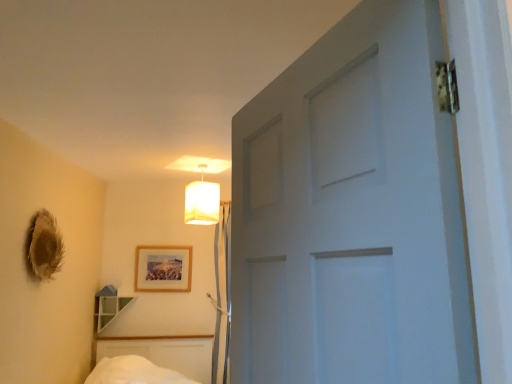
This screenshot has height=384, width=512. In order to click on empty space that is ontop of matte white lampshade at upper center (from a real-world perspective) in this screenshot , I will do `click(201, 160)`.